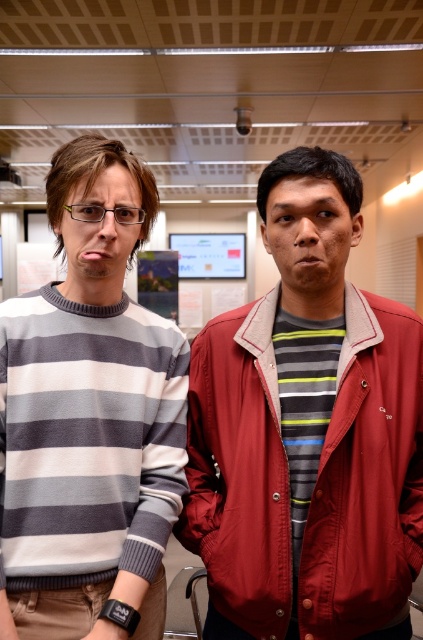
You are an assistant helping to organize a clothing donation drive. You have a storage box that can only fit items up to the size of the striped wool sweater at left. Can the matte red jacket at center fit into the box?

The matte red jacket at center is larger than the striped wool sweater at left, so it cannot fit into the storage box designed for items up to the size of the striped wool sweater at left.

Consider the image. You are standing in an office and see two points marked on the wall. The first point is at coordinate point (346, 406) and the second is at coordinate point (30, 531). Which point is closer to you?

Point (346, 406) is further to the camera than point (30, 531), so the point closer to you is point (30, 531).